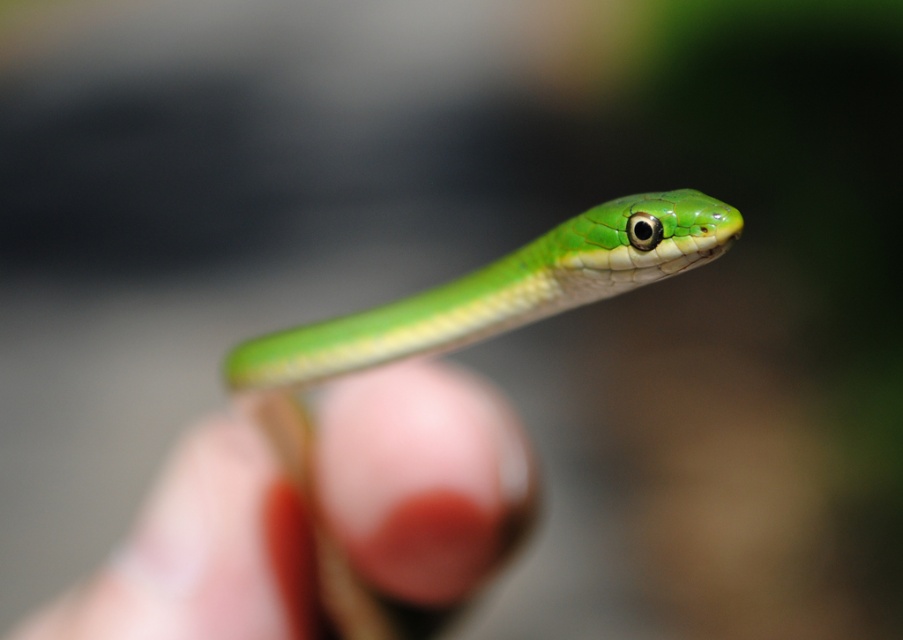
Question: Does green smooth skin at center appear over green smooth snake at center?

Choices:
 (A) no
 (B) yes

Answer: (A)

Question: Can you confirm if green smooth skin at center is positioned to the left of green smooth snake at center?

Choices:
 (A) no
 (B) yes

Answer: (B)

Question: Which point is closer to the camera?

Choices:
 (A) (455, 413)
 (B) (382, 321)

Answer: (A)

Question: Does green smooth skin at center appear over green smooth snake at center?

Choices:
 (A) no
 (B) yes

Answer: (A)

Question: Which of the following is the farthest from the observer?

Choices:
 (A) (241, 627)
 (B) (634, 196)

Answer: (B)

Question: Which point is closer to the camera?

Choices:
 (A) green smooth skin at center
 (B) green smooth snake at center

Answer: (A)